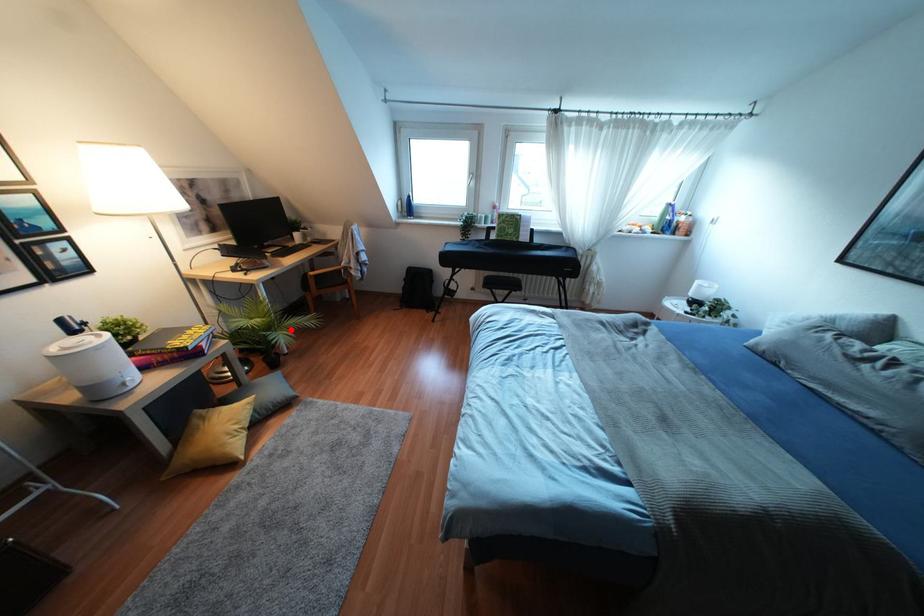
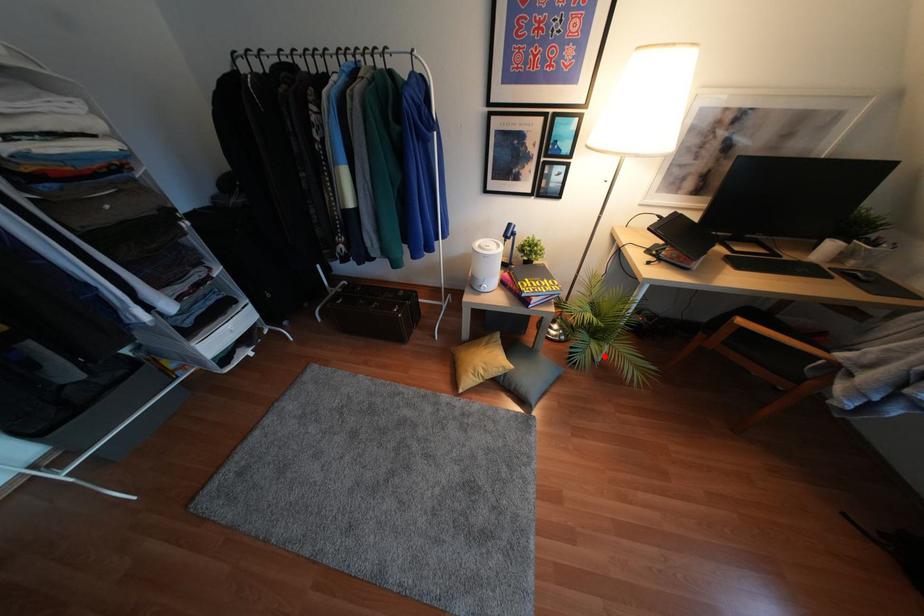
I am providing you with two images of the same scene from different viewpoints. A red point is marked on the first image and another point is marked on the second image. Is the marked point in image1 the same physical position as the marked point in image2?

Yes